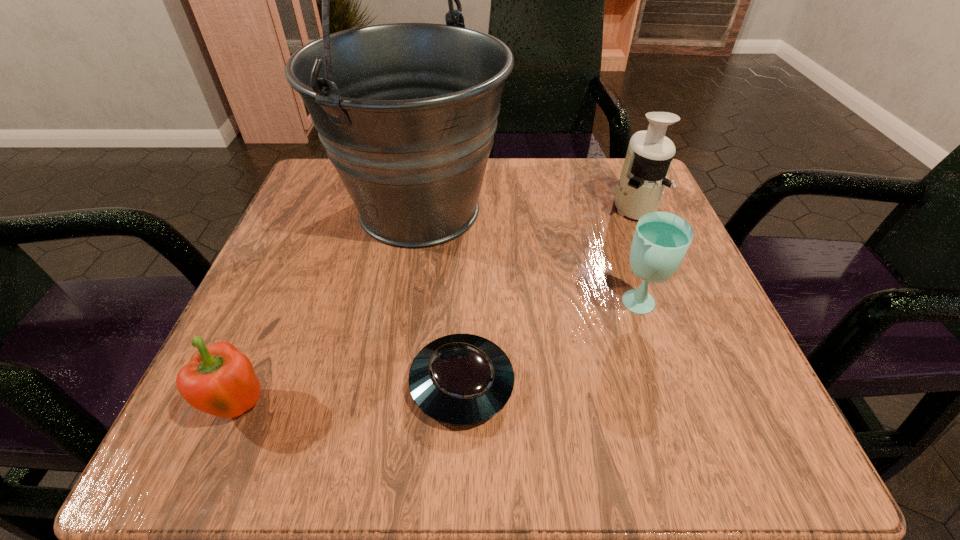
Where is `vacant area that lies between the saucer and the third farthest object`? This screenshot has width=960, height=540. vacant area that lies between the saucer and the third farthest object is located at coordinates (549, 345).

Where is `free space between the tallest object and the pepper`? free space between the tallest object and the pepper is located at coordinates tap(330, 308).

This screenshot has height=540, width=960. Find the location of `empty space that is in between the shortest object and the third tallest object`. empty space that is in between the shortest object and the third tallest object is located at coordinates (549, 345).

I want to click on vacant point located between the fourth shortest object and the saucer, so click(548, 295).

Where is `free space between the tallest object and the third farthest object`? The width and height of the screenshot is (960, 540). free space between the tallest object and the third farthest object is located at coordinates (528, 258).

What are the coordinates of `vacant space in between the bucket and the pepper` in the screenshot? It's located at (330, 308).

This screenshot has width=960, height=540. Find the location of `free space between the pepper and the fourth shortest object`. free space between the pepper and the fourth shortest object is located at coordinates (438, 306).

At what (x,y) coordinates should I click in order to perform the action: click on object that is the closest to the pepper. Please return your answer as a coordinate pair (x, y). The width and height of the screenshot is (960, 540). Looking at the image, I should click on (460, 379).

Find the location of a particular element. Image resolution: width=960 pixels, height=540 pixels. the third closest object relative to the juicer is located at coordinates (460, 379).

This screenshot has width=960, height=540. Find the location of `vacant position in the image that satisfies the following two spatial constraints: 1. on the back side of the bucket; 2. on the left side of the fourth tallest object`. vacant position in the image that satisfies the following two spatial constraints: 1. on the back side of the bucket; 2. on the left side of the fourth tallest object is located at coordinates (324, 210).